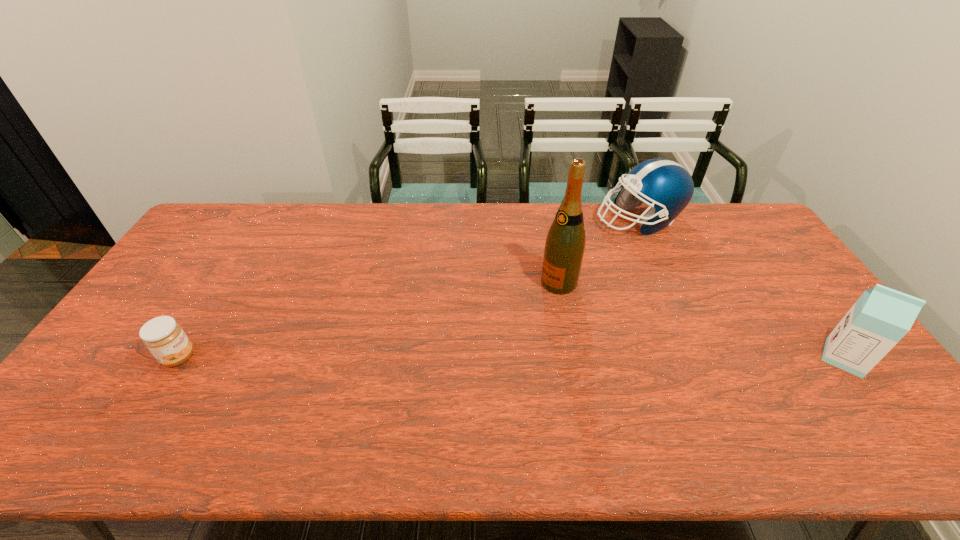
The height and width of the screenshot is (540, 960). In the image, there is a desktop. Identify the location of free space at the left edge. (179, 258).

Image resolution: width=960 pixels, height=540 pixels. In the image, there is a desktop. What are the coordinates of `vacant space at the right edge` in the screenshot? It's located at (798, 339).

In the image, there is a desktop. Where is `vacant space at the far left corner`? The image size is (960, 540). vacant space at the far left corner is located at coordinates (234, 218).

This screenshot has height=540, width=960. I want to click on blank space at the far right corner, so click(716, 219).

I want to click on vacant space at the near right corner of the desktop, so click(826, 399).

Locate an element on the screen. vacant space that's between the second farthest object and the rightmost object is located at coordinates (702, 320).

Image resolution: width=960 pixels, height=540 pixels. What are the coordinates of `vacant area that lies between the leftmost object and the third object from right to left` in the screenshot? It's located at pos(369,320).

You are a GUI agent. You are given a task and a screenshot of the screen. Output one action in this format:
    pyautogui.click(x=<x>, y=<y>)
    Task: Click on the vacant space that's between the rightmost object and the third object from left to right
    The image size is (960, 540).
    Given the screenshot: What is the action you would take?
    pyautogui.click(x=741, y=289)

Where is `free space between the leftmost object and the third object from left to right`? free space between the leftmost object and the third object from left to right is located at coordinates (409, 289).

Locate an element on the screen. The image size is (960, 540). vacant area that lies between the jam and the wine bottle is located at coordinates pyautogui.click(x=369, y=320).